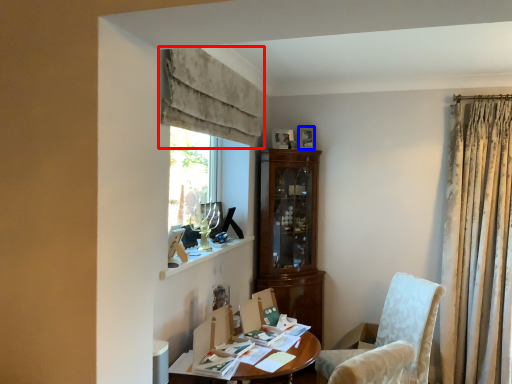
Question: Which point is further to the camera, curtain (highlighted by a red box) or picture frame (highlighted by a blue box)?

Choices:
 (A) curtain
 (B) picture frame

Answer: (B)